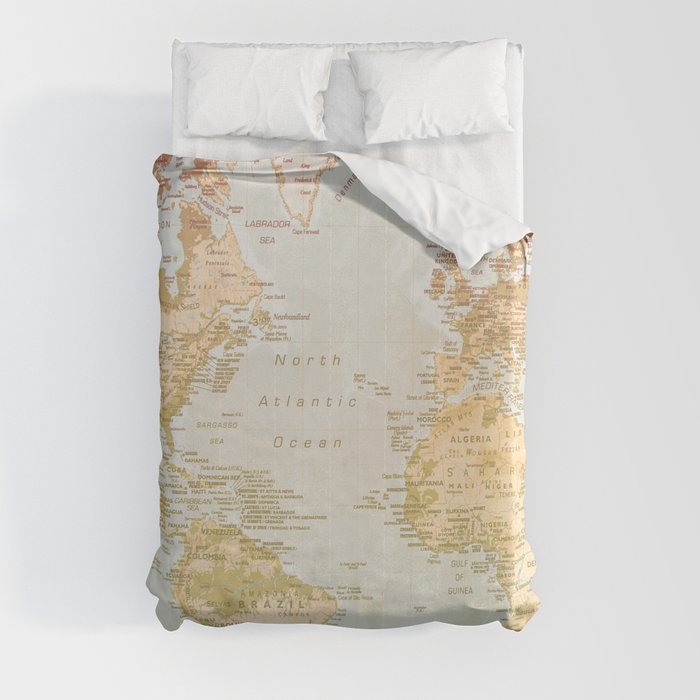
The height and width of the screenshot is (700, 700). I want to click on pillows, so coord(281,89), coord(421,97).